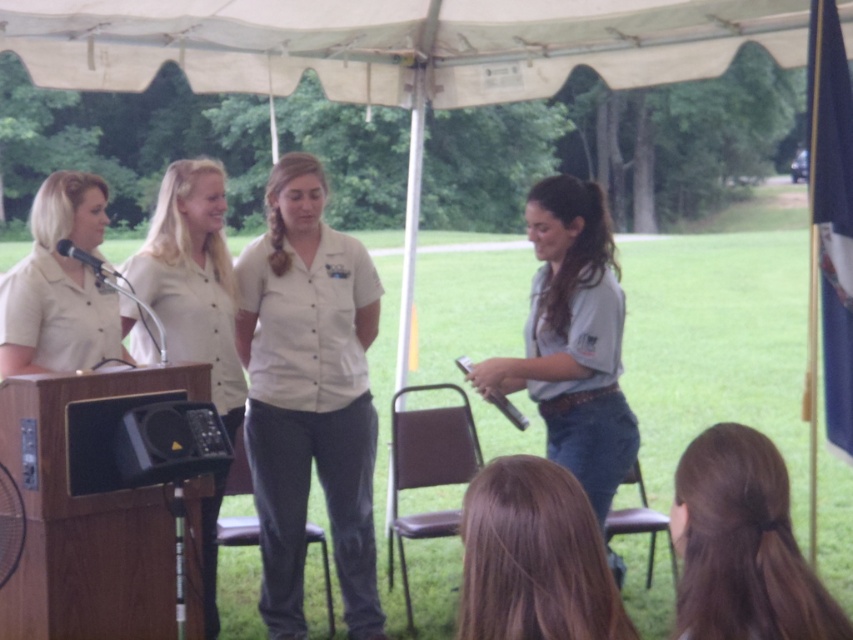
Question: Which object is farther from the camera taking this photo?

Choices:
 (A) matte black microphone at left
 (B) gray cotton shirt at right
 (C) matte white shirt at left

Answer: (A)

Question: Is matte white shirt at left positioned before matte black microphone at left?

Choices:
 (A) no
 (B) yes

Answer: (B)

Question: Is matte white shirt at left below matte black microphone at left?

Choices:
 (A) no
 (B) yes

Answer: (B)

Question: Which object appears closest to the camera in this image?

Choices:
 (A) white cotton shirt at center
 (B) brown hair at lower right
 (C) matte black microphone at left
 (D) white fabric canopy at upper center

Answer: (B)

Question: Is gray cotton shirt at right closer to the viewer compared to matte white blouse at center?

Choices:
 (A) yes
 (B) no

Answer: (A)

Question: Which of the following is the closest to the observer?

Choices:
 (A) matte black microphone at left
 (B) brown hair at lower right
 (C) metallic silver microphone at right

Answer: (B)